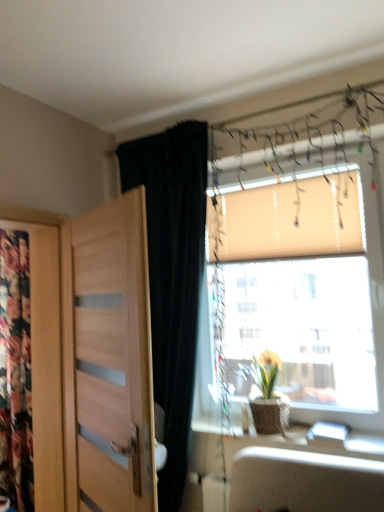
Question: From a real-world perspective, does wooden blinds at upper right sit lower than green leafy plant in woven basket at window?

Choices:
 (A) yes
 (B) no

Answer: (B)

Question: Are wooden blinds at upper right and green leafy plant in woven basket at window far apart?

Choices:
 (A) no
 (B) yes

Answer: (A)

Question: Is wooden blinds at upper right closer to camera compared to green leafy plant in woven basket at window?

Choices:
 (A) yes
 (B) no

Answer: (A)

Question: From the image's perspective, is wooden blinds at upper right located beneath green leafy plant in woven basket at window?

Choices:
 (A) no
 (B) yes

Answer: (A)

Question: Is wooden blinds at upper right oriented towards green leafy plant in woven basket at window?

Choices:
 (A) no
 (B) yes

Answer: (B)

Question: Does wooden blinds at upper right have a greater width compared to green leafy plant in woven basket at window?

Choices:
 (A) yes
 (B) no

Answer: (B)

Question: Considering the relative sizes of floral fabric at left and beige fabric blind at upper right in the image provided, is floral fabric at left bigger than beige fabric blind at upper right?

Choices:
 (A) yes
 (B) no

Answer: (A)

Question: Considering the relative sizes of floral fabric at left and beige fabric blind at upper right in the image provided, is floral fabric at left taller than beige fabric blind at upper right?

Choices:
 (A) no
 (B) yes

Answer: (B)

Question: Is floral fabric at left in front of beige fabric blind at upper right?

Choices:
 (A) no
 (B) yes

Answer: (A)

Question: Can you confirm if floral fabric at left is smaller than beige fabric blind at upper right?

Choices:
 (A) yes
 (B) no

Answer: (B)

Question: Does floral fabric at left have a greater width compared to beige fabric blind at upper right?

Choices:
 (A) yes
 (B) no

Answer: (A)

Question: Does floral fabric at left appear on the right side of beige fabric blind at upper right?

Choices:
 (A) no
 (B) yes

Answer: (A)

Question: Does black velvet curtain at left have a smaller size compared to wooden blinds at upper right?

Choices:
 (A) no
 (B) yes

Answer: (A)